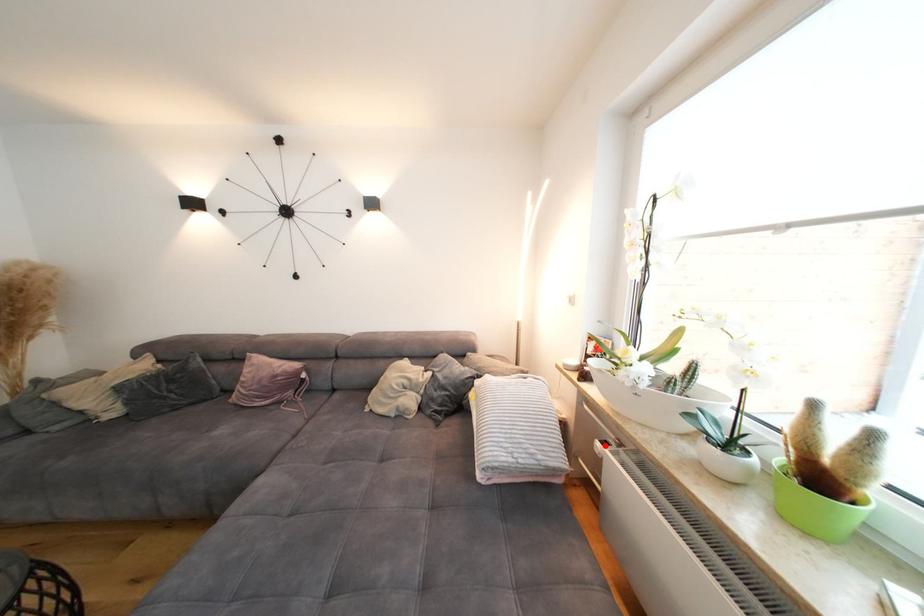
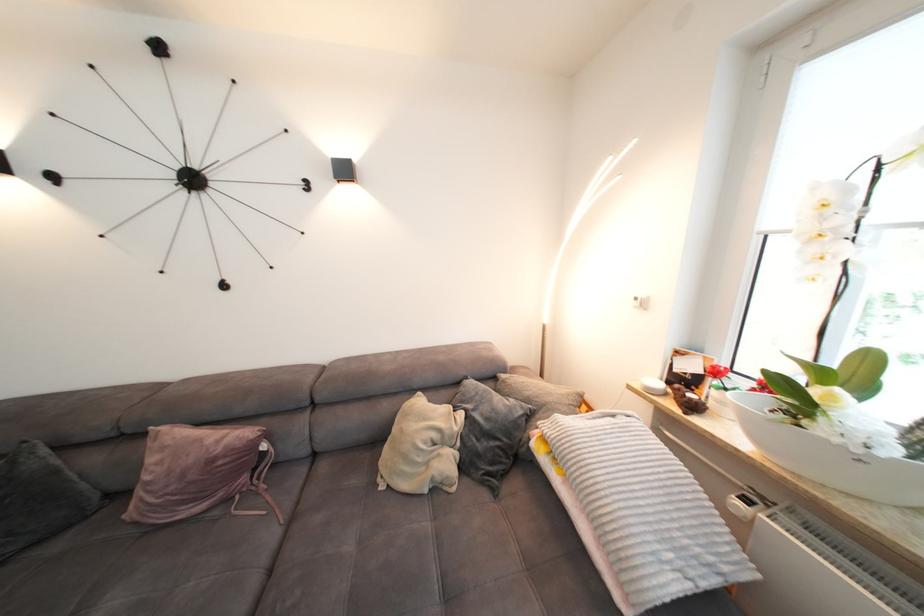
Where in the second image is the point corresponding to the highlighted location from the first image?

(746, 505)